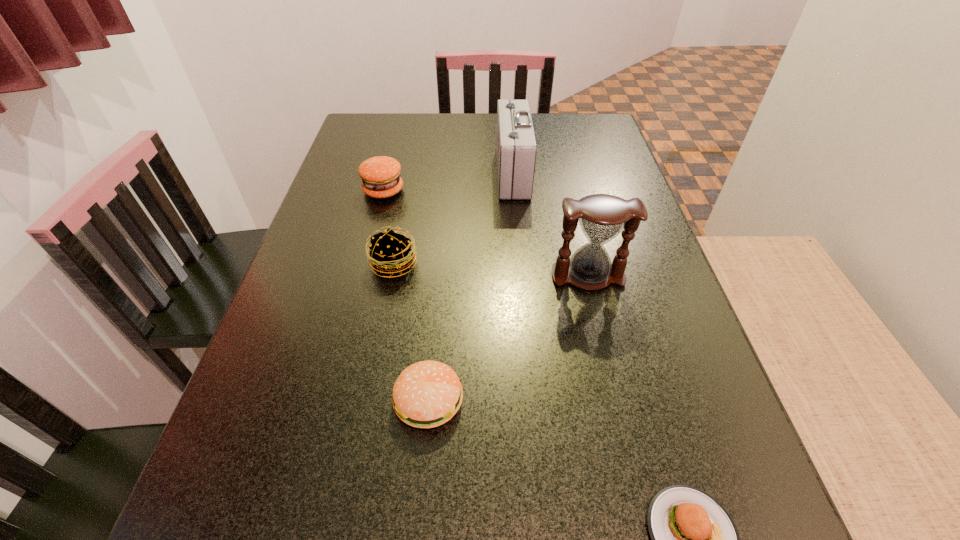
This screenshot has height=540, width=960. Identify the location of free region that satisfies the following two spatial constraints: 1. on the front-facing side of the third object from right to left; 2. on the left side of the hourglass. (522, 276).

The image size is (960, 540). Identify the location of vacant region that satisfies the following two spatial constraints: 1. on the front-facing side of the third object from right to left; 2. on the right side of the hourglass. (522, 276).